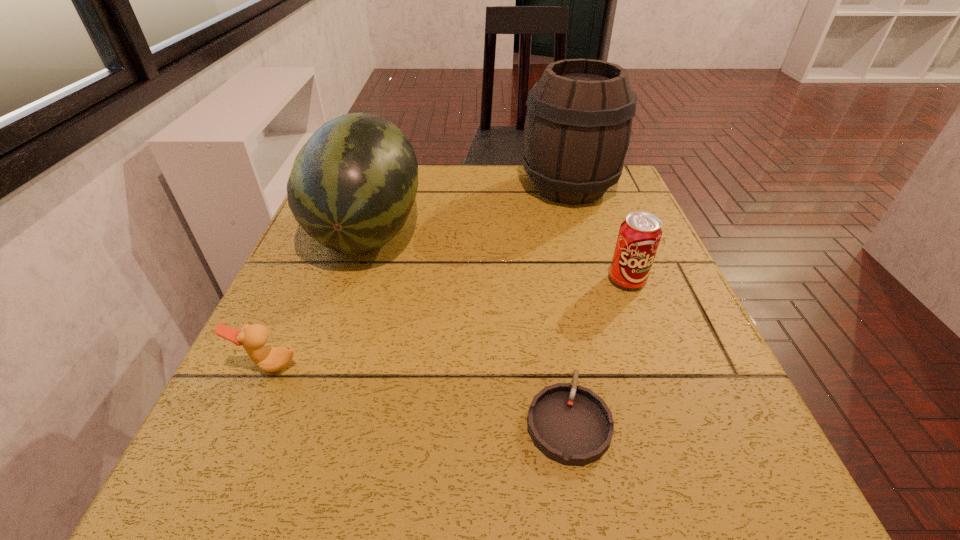
Where is `vacant space that's between the ashtray and the soda`? vacant space that's between the ashtray and the soda is located at coordinates (597, 350).

This screenshot has width=960, height=540. I want to click on free space between the nearest object and the wine bucket, so click(568, 303).

Where is `vacant point located between the second nearest object and the watermelon`? This screenshot has height=540, width=960. vacant point located between the second nearest object and the watermelon is located at coordinates (318, 298).

Where is `free area in between the wine bucket and the second shortest object`? free area in between the wine bucket and the second shortest object is located at coordinates pos(419,276).

Identify the location of unoccupied area between the second shortest object and the nearest object. (419, 393).

You are a GUI agent. You are given a task and a screenshot of the screen. Output one action in this format:
    pyautogui.click(x=<x>, y=<y>)
    Task: Click on the vacant space that's between the fourth tallest object and the wine bucket
    The width and height of the screenshot is (960, 540).
    Given the screenshot: What is the action you would take?
    pyautogui.click(x=419, y=276)

You are a GUI agent. You are given a task and a screenshot of the screen. Output one action in this format:
    pyautogui.click(x=<x>, y=<y>)
    Task: Click on the object that is the second closest to the watermelon
    
    Given the screenshot: What is the action you would take?
    pyautogui.click(x=578, y=124)

Identify which object is the second closest to the wine bucket. Please provide its 2D coordinates. Your answer should be formatted as a tuple, i.e. [(x, y)], where the tuple contains the x and y coordinates of a point satisfying the conditions above.

[(352, 186)]

Identify the location of vacant space that satisfies the following two spatial constraints: 1. on the back side of the wine bucket; 2. on the left side of the shortest object. (529, 187).

The image size is (960, 540). I want to click on vacant space that satisfies the following two spatial constraints: 1. on the back side of the ashtray; 2. on the left side of the third shortest object, so tap(544, 280).